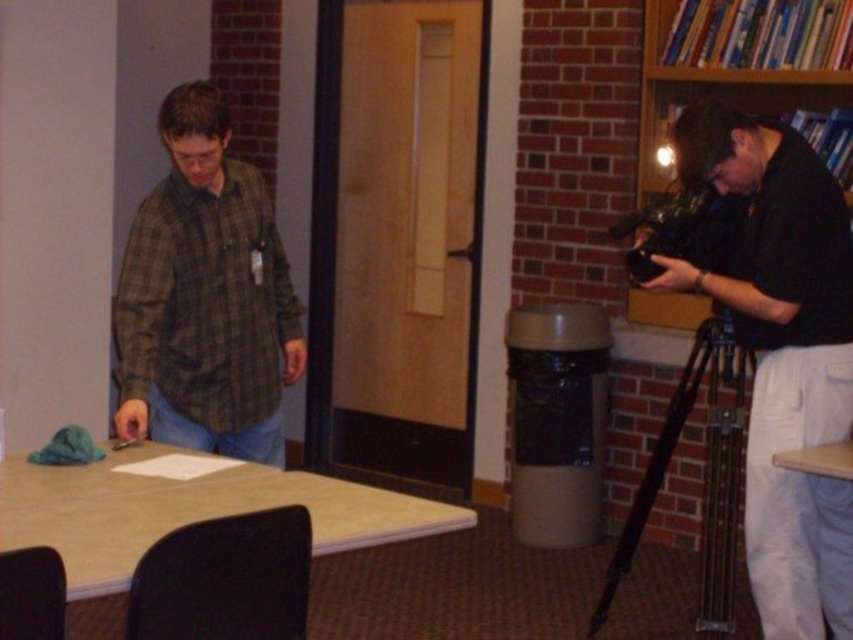
Question: Which object is closer to the camera taking this photo?

Choices:
 (A) black metallic tripod at lower right
 (B) teal fabric at table left

Answer: (B)

Question: Does light brown laminate table at lower left have a larger size compared to wooden table at lower right?

Choices:
 (A) no
 (B) yes

Answer: (B)

Question: Is green plaid shirt at left smaller than light brown laminate table at lower left?

Choices:
 (A) no
 (B) yes

Answer: (A)

Question: Which object is the farthest from the green plaid shirt at left?

Choices:
 (A) black plastic video camera at right
 (B) black matte camera at right

Answer: (A)

Question: Can you confirm if green plaid shirt at left is positioned to the right of black plastic video camera at right?

Choices:
 (A) no
 (B) yes

Answer: (A)

Question: Considering the real-world distances, which object is farthest from the wooden table at lower right?

Choices:
 (A) green plaid shirt at left
 (B) black plastic video camera at right
 (C) light brown laminate table at lower left
 (D) black metallic tripod at lower right

Answer: (A)